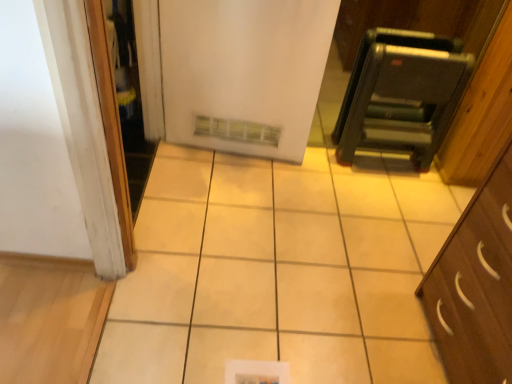
Question: From the image's perspective, is white matte refrigerator at center located above metallic black step ladder at upper right?

Choices:
 (A) no
 (B) yes

Answer: (B)

Question: Is white matte refrigerator at center surrounding metallic black step ladder at upper right?

Choices:
 (A) yes
 (B) no

Answer: (B)

Question: Considering the relative sizes of white matte refrigerator at center and metallic black step ladder at upper right in the image provided, is white matte refrigerator at center shorter than metallic black step ladder at upper right?

Choices:
 (A) no
 (B) yes

Answer: (A)

Question: Is white matte refrigerator at center positioned beyond the bounds of metallic black step ladder at upper right?

Choices:
 (A) yes
 (B) no

Answer: (A)

Question: Are white matte refrigerator at center and metallic black step ladder at upper right far apart?

Choices:
 (A) no
 (B) yes

Answer: (A)

Question: Is point (287, 16) positioned closer to the camera than point (109, 79)?

Choices:
 (A) farther
 (B) closer

Answer: (A)

Question: Is white matte refrigerator at center spatially inside white glossy screen door at left, or outside of it?

Choices:
 (A) inside
 (B) outside

Answer: (B)

Question: Looking at the image, does white matte refrigerator at center seem bigger or smaller compared to white glossy screen door at left?

Choices:
 (A) small
 (B) big

Answer: (A)

Question: From a real-world perspective, is white matte refrigerator at center positioned above or below white glossy screen door at left?

Choices:
 (A) below
 (B) above

Answer: (A)

Question: From the image's perspective, is metallic black step ladder at upper right above or below white matte refrigerator at center?

Choices:
 (A) above
 (B) below

Answer: (B)

Question: Is point (448, 64) closer or farther from the camera than point (241, 86)?

Choices:
 (A) farther
 (B) closer

Answer: (B)

Question: Considering the positions of metallic black step ladder at upper right and white matte refrigerator at center in the image, is metallic black step ladder at upper right wider or thinner than white matte refrigerator at center?

Choices:
 (A) wide
 (B) thin

Answer: (A)

Question: Based on their positions, is metallic black step ladder at upper right located to the left or right of white matte refrigerator at center?

Choices:
 (A) left
 (B) right

Answer: (B)

Question: Does point (443, 117) appear closer or farther from the camera than point (121, 137)?

Choices:
 (A) closer
 (B) farther

Answer: (B)

Question: Looking at their shapes, would you say metallic black step ladder at upper right is wider or thinner than white glossy screen door at left?

Choices:
 (A) wide
 (B) thin

Answer: (A)